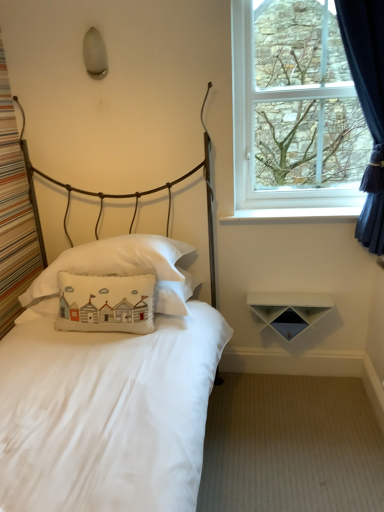
This screenshot has width=384, height=512. Find the location of `white matte bed at left`. white matte bed at left is located at coordinates (109, 381).

This screenshot has width=384, height=512. I want to click on white painted wood at upper right, so click(293, 214).

What is the approximate width of white painted wood at upper right?

white painted wood at upper right is 7.85 inches in width.

In order to face white matte shelf at lower right, should I rotate leftwards or rightwards?

To align with it, rotate right about 12.989°.

Where is `white matte bed at left`? white matte bed at left is located at coordinates (109, 381).

Is white matte shelf at lower right inside or outside of white matte bed at left?

white matte shelf at lower right exists outside the volume of white matte bed at left.

Considering the relative sizes of white matte shelf at lower right and white matte bed at left in the image provided, is white matte shelf at lower right wider than white matte bed at left?

No, white matte shelf at lower right is not wider than white matte bed at left.

Which object is closer to the camera, white matte shelf at lower right or white matte bed at left?

Positioned in front is white matte bed at left.

Is white painted wood at upper right positioned before clear glass window at upper right?

No, the depth of white painted wood at upper right is greater than that of clear glass window at upper right.

The height and width of the screenshot is (512, 384). In order to click on window that is above the white painted wood at upper right (from the image's perspective) in this screenshot , I will do `click(294, 112)`.

Would you say white painted wood at upper right is to the left or to the right of clear glass window at upper right in the picture?

white painted wood at upper right is positioned on clear glass window at upper right's left side.

From the image's perspective, between white painted wood at upper right and clear glass window at upper right, which one is located above?

clear glass window at upper right is shown above in the image.

Is white matte bed at left beside white cotton pillow at center, placed as the 1th pillow when sorted from bottom to top?

No, white matte bed at left is not next to white cotton pillow at center, placed as the 1th pillow when sorted from bottom to top.

I want to click on the 2nd pillow located beneath the white matte bed at left (from a real-world perspective), so click(x=106, y=303).

Considering the relative sizes of white matte bed at left and white cotton pillow at center, placed as the 1th pillow when sorted from bottom to top, in the image provided, is white matte bed at left smaller than white cotton pillow at center, placed as the 1th pillow when sorted from bottom to top,?

Actually, white matte bed at left might be larger than white cotton pillow at center, placed as the 1th pillow when sorted from bottom to top.

From the clear glass window at upper right, count the 1st pillow to the left and point to it. Please provide its 2D coordinates.

[(175, 294)]

Considering the sizes of objects clear glass window at upper right and white cotton pillow at center, which ranks as the second pillow in bottom-to-top order, in the image provided, who is bigger, clear glass window at upper right or white cotton pillow at center, which ranks as the second pillow in bottom-to-top order,?

With larger size is white cotton pillow at center, which ranks as the second pillow in bottom-to-top order.

Can you tell me how much clear glass window at upper right and white cotton pillow at center, the second pillow when ordered from top to bottom, differ in facing direction?

They differ by 0.096 degrees in their facing directions.

From the image's perspective, relative to white cotton pillow at center, which ranks as the second pillow in bottom-to-top order, is clear glass window at upper right above or below?

clear glass window at upper right is situated higher than white cotton pillow at center, which ranks as the second pillow in bottom-to-top order, in the image.

This screenshot has width=384, height=512. I want to click on window sill that is above the white matte bed at left (from the image's perspective), so click(293, 214).

Is white matte bed at left facing towards white painted wood at upper right?

No, white matte bed at left does not turn towards white painted wood at upper right.

Does white matte bed at left appear on the left side of white painted wood at upper right?

Correct, you'll find white matte bed at left to the left of white painted wood at upper right.

Would you say clear glass window at upper right is outside white matte shelf at lower right?

Yes, clear glass window at upper right is outside of white matte shelf at lower right.

From the image's perspective, is clear glass window at upper right above or below white matte shelf at lower right?

From the image's perspective, clear glass window at upper right appears above white matte shelf at lower right.

Considering the relative positions of clear glass window at upper right and white matte shelf at lower right in the image provided, is clear glass window at upper right behind white matte shelf at lower right?

No, clear glass window at upper right is in front of white matte shelf at lower right.

Is point (58, 347) positioned after point (95, 250)?

No.

From the picture: Between white matte bed at left and white cotton pillow at center, positioned as the 1th pillow in top-to-bottom order, which one is positioned in front?

Positioned in front is white matte bed at left.

From the image's perspective, is white matte bed at left over white cotton pillow at center, positioned as the 1th pillow in top-to-bottom order?

Incorrect, from the image's perspective, white matte bed at left is lower than white cotton pillow at center, positioned as the 1th pillow in top-to-bottom order.

Is white matte bed at left far from white cotton pillow at center, positioned as the 1th pillow in top-to-bottom order?

No.

Locate an element on the screen. The width and height of the screenshot is (384, 512). bed in front of the white matte shelf at lower right is located at coordinates (109, 381).

The width and height of the screenshot is (384, 512). Identify the location of window sill that is on the left side of clear glass window at upper right. pos(293,214).

Based on their spatial positions, is white matte bed at left or white cotton pillow at center, the second pillow when ordered from top to bottom, further from clear glass window at upper right?

Based on the image, white cotton pillow at center, the second pillow when ordered from top to bottom, appears to be further to clear glass window at upper right.

Considering their positions, is white matte shelf at lower right positioned closer to white matte bed at left than clear glass window at upper right?

Based on the image, white matte shelf at lower right appears to be nearer to white matte bed at left.

Which object lies nearer to the anchor point white matte shelf at lower right, clear glass window at upper right or white cotton pillow at center, positioned as the 1th pillow in top-to-bottom order?

Among the two, white cotton pillow at center, positioned as the 1th pillow in top-to-bottom order, is located nearer to white matte shelf at lower right.

From the image, which object appears to be nearer to white cotton pillow at center, which ranks as the 3th pillow in bottom-to-top order, white matte shelf at lower right or white painted wood at upper right?

The object closer to white cotton pillow at center, which ranks as the 3th pillow in bottom-to-top order, is white painted wood at upper right.

From the image, which object appears to be nearer to white cotton pillow at center, which ranks as the second pillow in bottom-to-top order, white painted wood at upper right or white matte bed at left?

white matte bed at left lies closer to white cotton pillow at center, which ranks as the second pillow in bottom-to-top order, than the other object.

Estimate the real-world distances between objects in this image. Which object is further from white cotton pillow at center, which ranks as the 3th pillow in bottom-to-top order, white cotton pillow at center, which ranks as the second pillow in bottom-to-top order, or white painted wood at upper right?

white painted wood at upper right is further to white cotton pillow at center, which ranks as the 3th pillow in bottom-to-top order.

Looking at the image, which one is located further to white painted wood at upper right, white cotton pillow at center, which ranks as the 3th pillow in bottom-to-top order, or dark blue velvet curtain at right?

The object further to white painted wood at upper right is white cotton pillow at center, which ranks as the 3th pillow in bottom-to-top order.

Estimate the real-world distances between objects in this image. Which object is further from white matte bed at left, white matte shelf at lower right or white cotton pillow at center, which ranks as the 3th pillow in bottom-to-top order?

white matte shelf at lower right.

Find the location of a particular element. The width and height of the screenshot is (384, 512). pillow located between white matte bed at left and white cotton pillow at center, which ranks as the 3th pillow in bottom-to-top order, in the depth direction is located at coordinates (106, 303).

Locate an element on the screen. window located between white matte bed at left and white painted wood at upper right in the depth direction is located at coordinates (294, 112).

This screenshot has width=384, height=512. I want to click on window sill situated between white cotton pillow at center, the second pillow when ordered from top to bottom, and white matte shelf at lower right from left to right, so click(x=293, y=214).

The width and height of the screenshot is (384, 512). I want to click on window situated between white cotton pillow at center, acting as the 3th pillow starting from the top, and dark blue velvet curtain at right from left to right, so click(x=294, y=112).